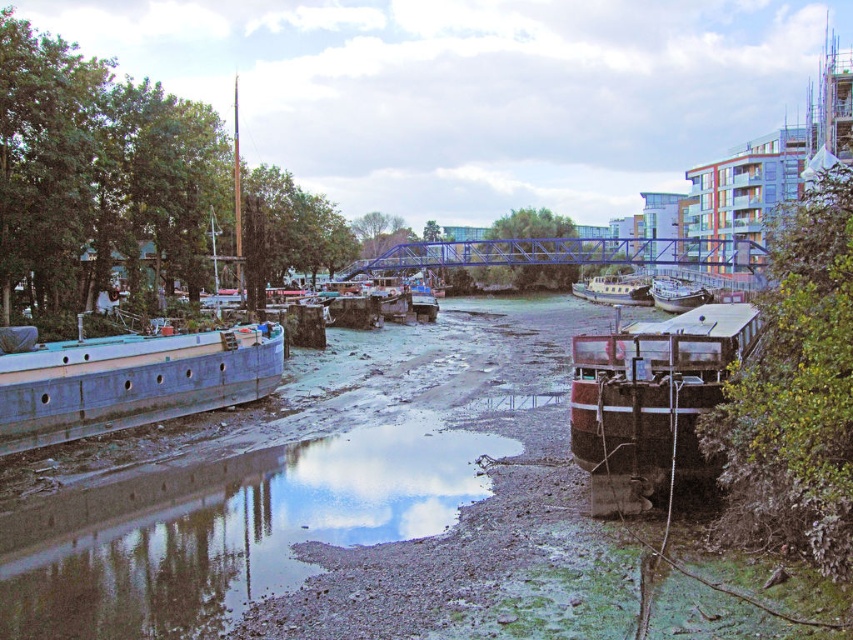
Based on the photo, who is more distant from viewer, [18,413] or [694,301]?

The point [694,301] is more distant.

Which is behind, point (143, 394) or point (659, 280)?

The point (659, 280) is more distant.

At what (x,y) coordinates should I click in order to perform the action: click on blue matte barge at left. Please return your answer as a coordinate pair (x, y). This screenshot has width=853, height=640. Looking at the image, I should click on (131, 381).

Which is behind, point (473, 488) or point (234, 376)?

The point (234, 376) is behind.

Can you confirm if muddy gravel river at center is bigger than blue matte barge at left?

Incorrect, muddy gravel river at center is not larger than blue matte barge at left.

Where is `muddy gravel river at center`? muddy gravel river at center is located at coordinates (229, 531).

Locate an element on the screen. This screenshot has height=640, width=853. muddy gravel river at center is located at coordinates (229, 531).

Is muddy gravel river at center to the left of wooden polished boat at center from the viewer's perspective?

Correct, you'll find muddy gravel river at center to the left of wooden polished boat at center.

Is point (172, 604) more distant than point (610, 280)?

No.

You are a GUI agent. You are given a task and a screenshot of the screen. Output one action in this format:
    pyautogui.click(x=<x>, y=<y>)
    Task: Click on the muddy gravel river at center
    
    Given the screenshot: What is the action you would take?
    pyautogui.click(x=229, y=531)